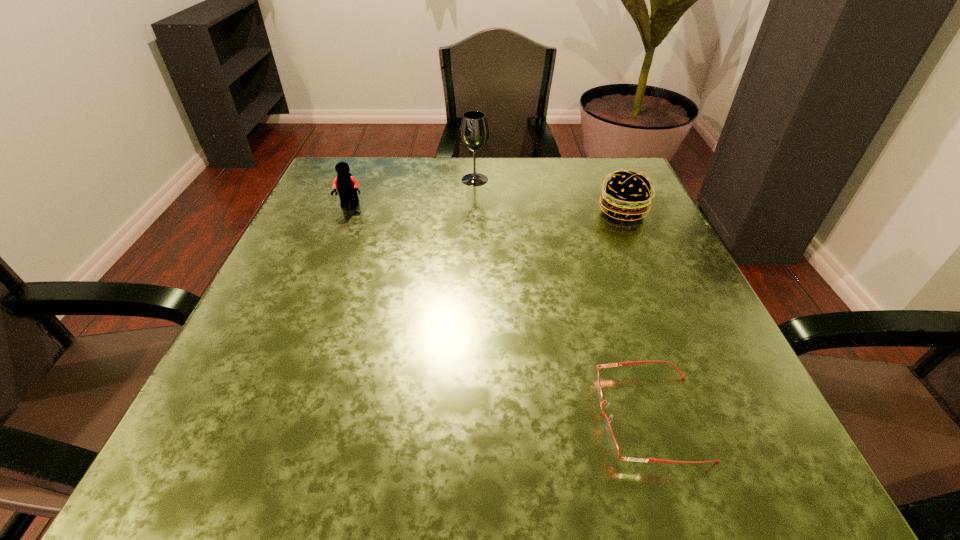
You are a GUI agent. You are given a task and a screenshot of the screen. Output one action in this format:
    pyautogui.click(x=<x>, y=<y>)
    Task: Click on the object positioned at the far right corner
    Image resolution: width=960 pixels, height=540 pixels.
    Given the screenshot: What is the action you would take?
    pyautogui.click(x=628, y=194)

Locate an element on the screen. The image size is (960, 540). object located at the near right corner is located at coordinates (612, 441).

Locate an element on the screen. The height and width of the screenshot is (540, 960). vacant region at the far edge is located at coordinates (555, 207).

Locate an element on the screen. Image resolution: width=960 pixels, height=540 pixels. free region at the near edge of the desktop is located at coordinates (381, 458).

You are a GUI agent. You are given a task and a screenshot of the screen. Output one action in this format:
    pyautogui.click(x=<x>, y=<y>)
    Task: Click on the vacant region at the left edge
    This screenshot has width=960, height=540.
    Given the screenshot: What is the action you would take?
    [355, 286]

Identify the location of free region at the right edge. (624, 288).

In the image, there is a desktop. What are the coordinates of `vacant region at the far left corner` in the screenshot? It's located at (324, 173).

The image size is (960, 540). In order to click on vacant space at the far right corner of the desktop in this screenshot , I will do `click(588, 187)`.

In the image, there is a desktop. Identify the location of free space at the near right corner. The image size is (960, 540). pos(775,473).

Image resolution: width=960 pixels, height=540 pixels. Identify the location of vacant area between the spectacles and the patty. (636, 314).